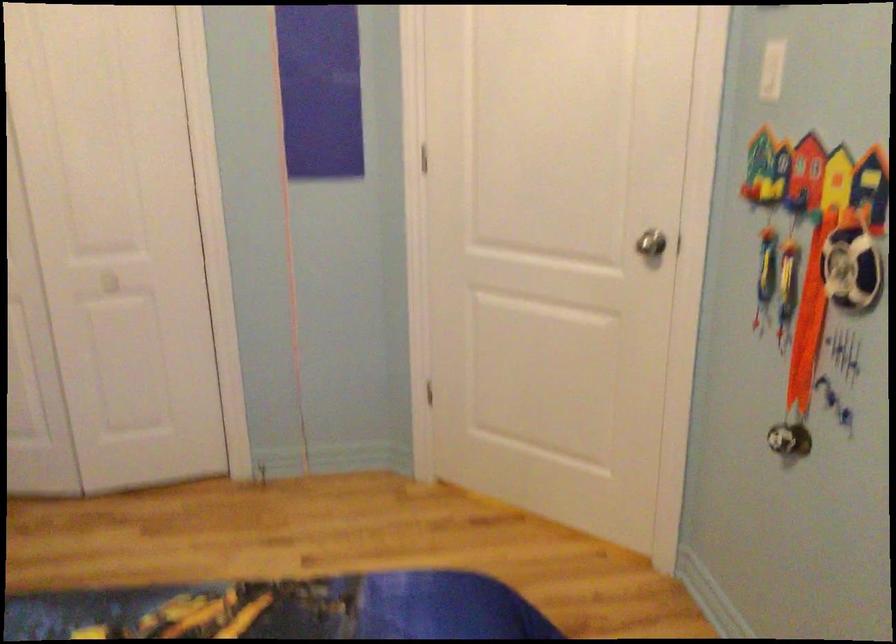
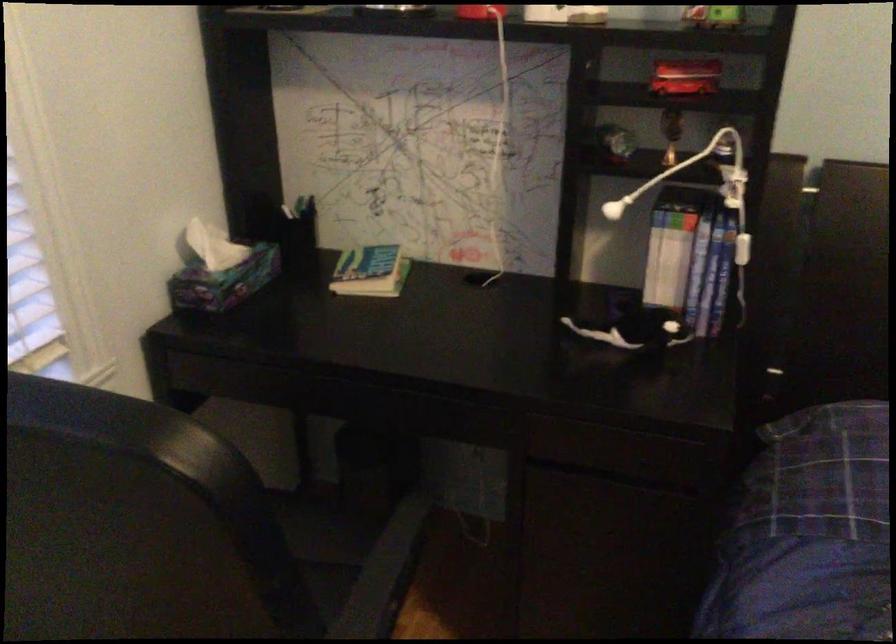
How did the camera likely rotate?

The camera rotated toward left-down.